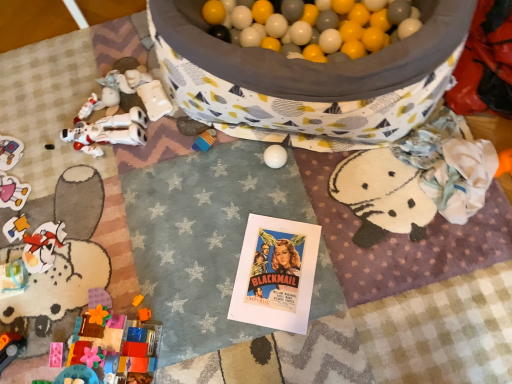
Where is `vacant space that is in between orange plastic car at lower left, positioned as the fourth toy in top-to-bottom order, and brick-like plastic blocks at lower left, which appears as the 4th toy when viewed from the back`? vacant space that is in between orange plastic car at lower left, positioned as the fourth toy in top-to-bottom order, and brick-like plastic blocks at lower left, which appears as the 4th toy when viewed from the back is located at coordinates (45, 349).